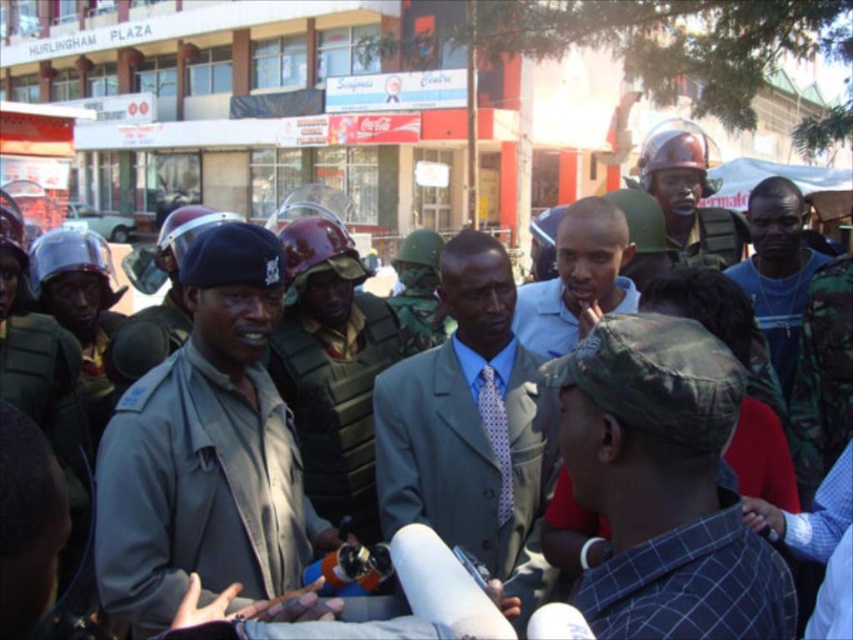
You are a photographer at the event and want to capture both the gray uniformed officer at center and the light gray suit at center in the same frame. Based on their positions, which one should be positioned to the left side of the camera frame to include both subjects?

The gray uniformed officer at center should be positioned to the left side of the camera frame since they are already to the left of the light gray suit at center in the original image.

You are a photographer trying to capture a clear shot of both the camo hat at center and the camouflage uniform at center. Since you want both to be visible in the frame, which object should you adjust your camera to focus on first to ensure the other remains in the background?

The camo hat at center is positioned on the left side of camouflage uniform at center. To ensure both are visible, focus on the camouflage uniform at center first, as it is on the right and the hat is to its left, keeping them within the frame.